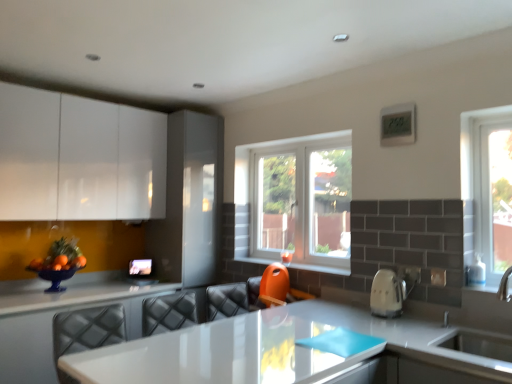
Question: Does white glossy countertop at lower center have a larger size compared to orange plastic at center?

Choices:
 (A) yes
 (B) no

Answer: (A)

Question: Does white glossy countertop at lower center have a smaller size compared to orange plastic at center?

Choices:
 (A) no
 (B) yes

Answer: (A)

Question: Considering the relative sizes of white glossy countertop at lower center and orange plastic at center in the image provided, is white glossy countertop at lower center taller than orange plastic at center?

Choices:
 (A) yes
 (B) no

Answer: (A)

Question: From the image's perspective, is white glossy countertop at lower center located above orange plastic at center?

Choices:
 (A) no
 (B) yes

Answer: (A)

Question: Is white glossy countertop at lower center thinner than orange plastic at center?

Choices:
 (A) yes
 (B) no

Answer: (B)

Question: Considering the positions of white glossy countertop at lower center and white glossy electric kettle at right in the image, is white glossy countertop at lower center bigger or smaller than white glossy electric kettle at right?

Choices:
 (A) small
 (B) big

Answer: (B)

Question: Is white glossy countertop at lower center in front of or behind white glossy electric kettle at right in the image?

Choices:
 (A) front
 (B) behind

Answer: (B)

Question: From a real-world perspective, relative to white glossy electric kettle at right, is white glossy countertop at lower center vertically above or below?

Choices:
 (A) above
 (B) below

Answer: (B)

Question: In terms of height, does white glossy countertop at lower center look taller or shorter compared to white glossy electric kettle at right?

Choices:
 (A) tall
 (B) short

Answer: (A)

Question: Is white plastic window at center bigger or smaller than white glossy countertop at lower center?

Choices:
 (A) big
 (B) small

Answer: (B)

Question: Considering their positions, is white plastic window at center located in front of or behind white glossy countertop at lower center?

Choices:
 (A) behind
 (B) front

Answer: (A)

Question: From a real-world perspective, is white plastic window at center above or below white glossy countertop at lower center?

Choices:
 (A) above
 (B) below

Answer: (A)

Question: From the image's perspective, relative to white glossy countertop at lower center, is white plastic window at center above or below?

Choices:
 (A) below
 (B) above

Answer: (B)

Question: Is white glossy countertop at lower center taller or shorter than orange plastic at center?

Choices:
 (A) short
 (B) tall

Answer: (B)

Question: Which is correct: white glossy countertop at lower center is inside orange plastic at center, or outside of it?

Choices:
 (A) outside
 (B) inside

Answer: (A)